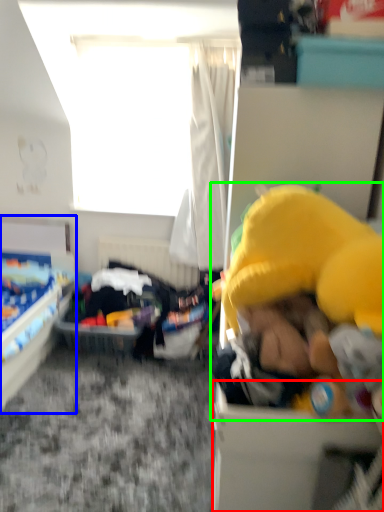
Question: Which object is positioned farthest from box (highlighted by a red box)? Select from bed (highlighted by a blue box) and toy (highlighted by a green box).

Choices:
 (A) bed
 (B) toy

Answer: (A)